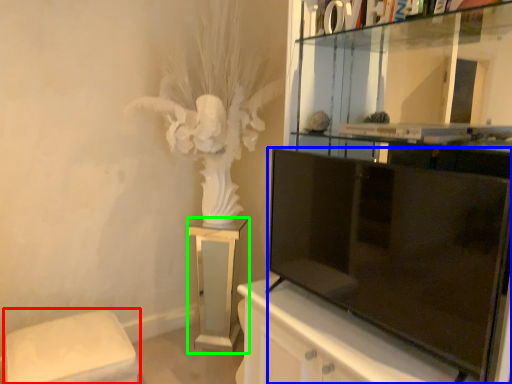
Question: Which is farther away from furniture (highlighted by a red box)? television (highlighted by a blue box) or furniture (highlighted by a green box)?

Choices:
 (A) television
 (B) furniture

Answer: (A)